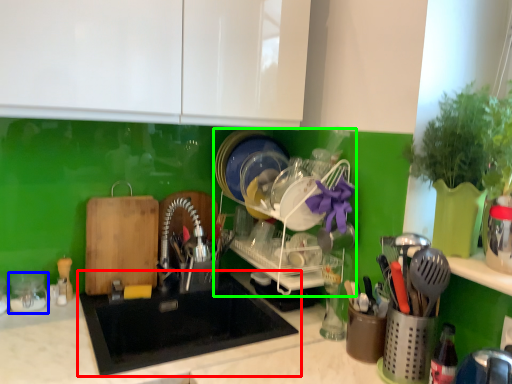
Question: Considering the real-world distances, which object is closest to sink (highlighted by a red box)? tableware (highlighted by a blue box) or dish washer (highlighted by a green box).

Choices:
 (A) tableware
 (B) dish washer

Answer: (B)